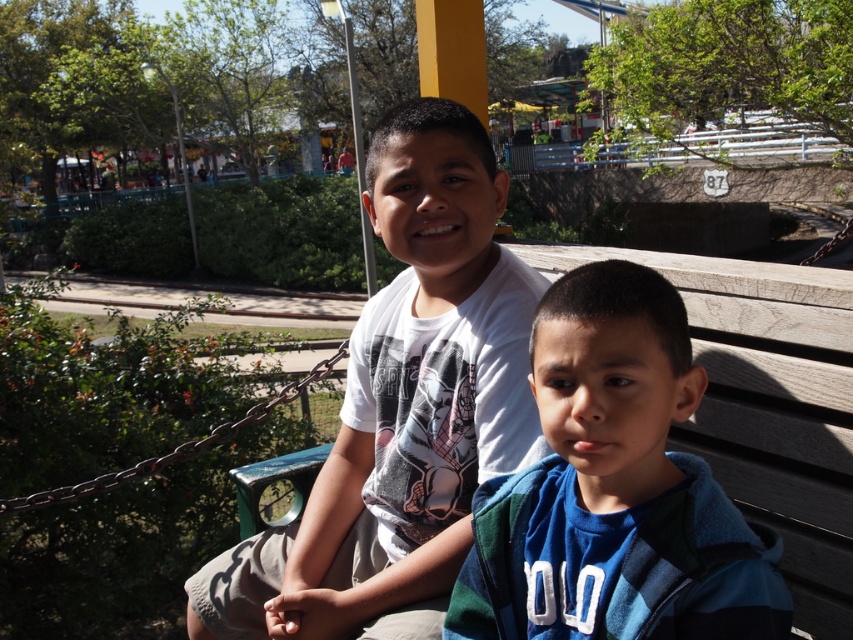
Does white cotton shirt at center have a smaller size compared to blue fleece jacket at center?

Incorrect, white cotton shirt at center is not smaller in size than blue fleece jacket at center.

Is white cotton shirt at center positioned at the back of blue fleece jacket at center?

Yes, it is.

Is point (437, 454) positioned before point (740, 589)?

No.

Find the location of a particular element. The width and height of the screenshot is (853, 640). white cotton shirt at center is located at coordinates (402, 408).